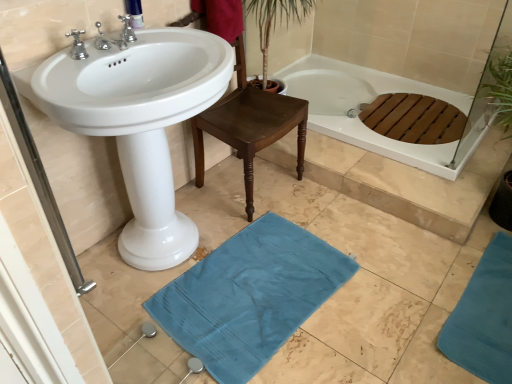
Question: Is satin nickel faucet at upper left, the 2th tap positioned from the back, turned away from white glossy bathtub at upper right?

Choices:
 (A) yes
 (B) no

Answer: (B)

Question: Can you confirm if satin nickel faucet at upper left, acting as the first tap starting from the front, is wider than white glossy bathtub at upper right?

Choices:
 (A) yes
 (B) no

Answer: (B)

Question: Is satin nickel faucet at upper left, acting as the first tap starting from the front, smaller than white glossy bathtub at upper right?

Choices:
 (A) no
 (B) yes

Answer: (B)

Question: Can you confirm if satin nickel faucet at upper left, acting as the first tap starting from the front, is bigger than white glossy bathtub at upper right?

Choices:
 (A) yes
 (B) no

Answer: (B)

Question: Considering the relative sizes of satin nickel faucet at upper left, the 2th tap positioned from the back, and white glossy bathtub at upper right in the image provided, is satin nickel faucet at upper left, the 2th tap positioned from the back, taller than white glossy bathtub at upper right?

Choices:
 (A) no
 (B) yes

Answer: (B)

Question: From a real-world perspective, is satin nickel faucet at upper left, the 2th tap positioned from the back, positioned under white glossy bathtub at upper right based on gravity?

Choices:
 (A) no
 (B) yes

Answer: (A)

Question: From the image's perspective, is satin nickel faucet at upper left, acting as the first tap starting from the front, beneath blue cotton beach towel at upper center?

Choices:
 (A) yes
 (B) no

Answer: (A)

Question: Is satin nickel faucet at upper left, acting as the first tap starting from the front, located outside blue cotton beach towel at upper center?

Choices:
 (A) yes
 (B) no

Answer: (A)

Question: Can you confirm if satin nickel faucet at upper left, the 2th tap positioned from the back, is positioned to the left of blue cotton beach towel at upper center?

Choices:
 (A) yes
 (B) no

Answer: (A)

Question: Is satin nickel faucet at upper left, acting as the first tap starting from the front, aimed at blue cotton beach towel at upper center?

Choices:
 (A) yes
 (B) no

Answer: (B)

Question: From a real-world perspective, is satin nickel faucet at upper left, acting as the first tap starting from the front, on top of blue cotton beach towel at upper center?

Choices:
 (A) no
 (B) yes

Answer: (B)

Question: Is satin nickel faucet at upper left, acting as the first tap starting from the front, thinner than blue cotton beach towel at upper center?

Choices:
 (A) yes
 (B) no

Answer: (B)

Question: From the image's perspective, is teal fabric bath mat at lower right, which is the first bath mat from right to left, below white glossy sink at center?

Choices:
 (A) yes
 (B) no

Answer: (A)